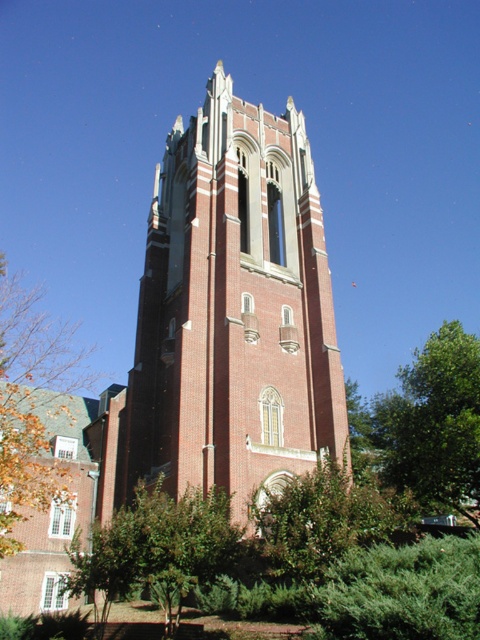
You are planning to take a photo of the brick tower at center and the green leafy tree at right. Which object should you focus on first if you want to capture both in a single frame without moving the camera?

The brick tower at center is larger than the green leafy tree at right, so you should focus on the brick tower at center first to ensure it fits properly in the frame.

You are standing in front of the Gothic brick tower and notice a point marked at coordinates (433, 422). What does this point indicate?

The point at coordinates (433, 422) marks the location of the green leafy tree at right.